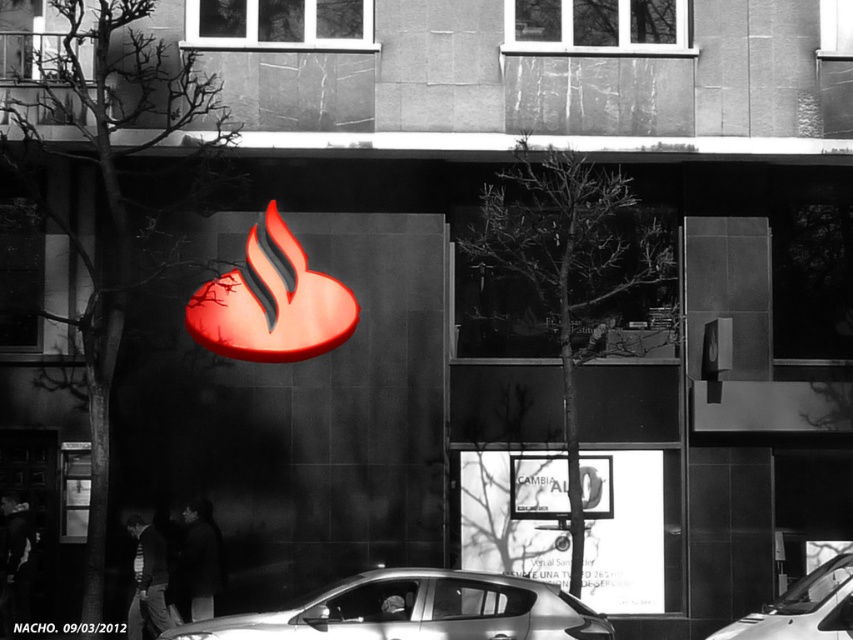
Question: Which point is closer to the camera?

Choices:
 (A) silver metallic car at lower center
 (B) glossy plastic heart at center
 (C) white glossy car at lower right

Answer: (C)

Question: Which of the following is the farthest from the observer?

Choices:
 (A) silver metallic car at lower center
 (B) glossy plastic heart at center
 (C) white glossy car at lower right

Answer: (B)

Question: Is silver metallic car at lower center to the right of glossy plastic heart at center from the viewer's perspective?

Choices:
 (A) yes
 (B) no

Answer: (A)

Question: Can you confirm if glossy plastic heart at center is smaller than white glossy car at lower right?

Choices:
 (A) no
 (B) yes

Answer: (B)

Question: Can you confirm if silver metallic car at lower center is thinner than glossy plastic heart at center?

Choices:
 (A) no
 (B) yes

Answer: (A)

Question: Which of the following is the farthest from the observer?

Choices:
 (A) glossy plastic heart at center
 (B) silver metallic car at lower center

Answer: (A)